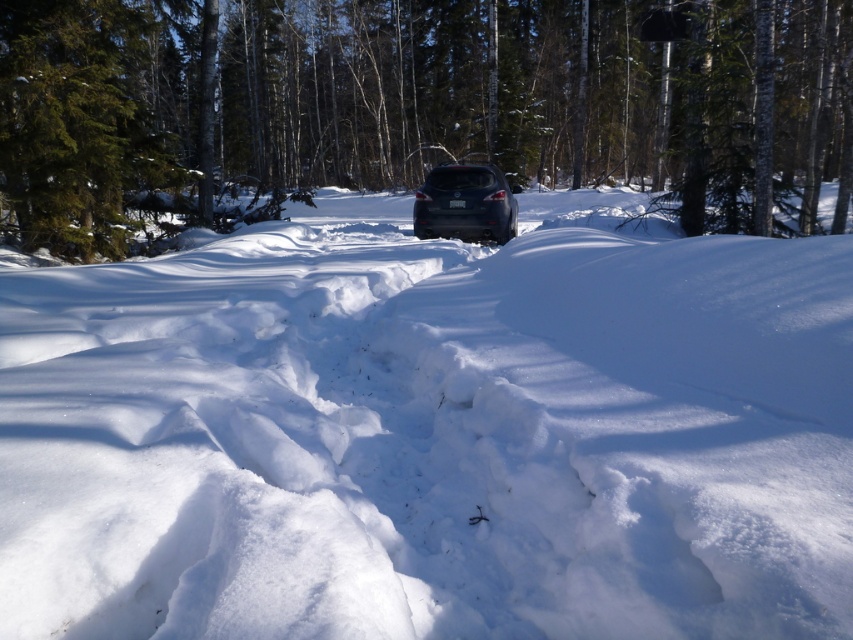
Question: Is white fluffy snow at center positioned at the back of satin dark gray suv at center?

Choices:
 (A) no
 (B) yes

Answer: (A)

Question: Can you confirm if white fluffy snow at center is positioned to the right of satin dark gray suv at center?

Choices:
 (A) no
 (B) yes

Answer: (A)

Question: Which point is farther to the camera?

Choices:
 (A) (776, 477)
 (B) (469, 214)

Answer: (B)

Question: Among these points, which one is farthest from the camera?

Choices:
 (A) (425, 212)
 (B) (218, 584)

Answer: (A)

Question: Which point is farther to the camera?

Choices:
 (A) (648, 349)
 (B) (434, 186)

Answer: (B)

Question: From the image, what is the correct spatial relationship of white fluffy snow at center in relation to satin dark gray suv at center?

Choices:
 (A) left
 (B) right

Answer: (A)